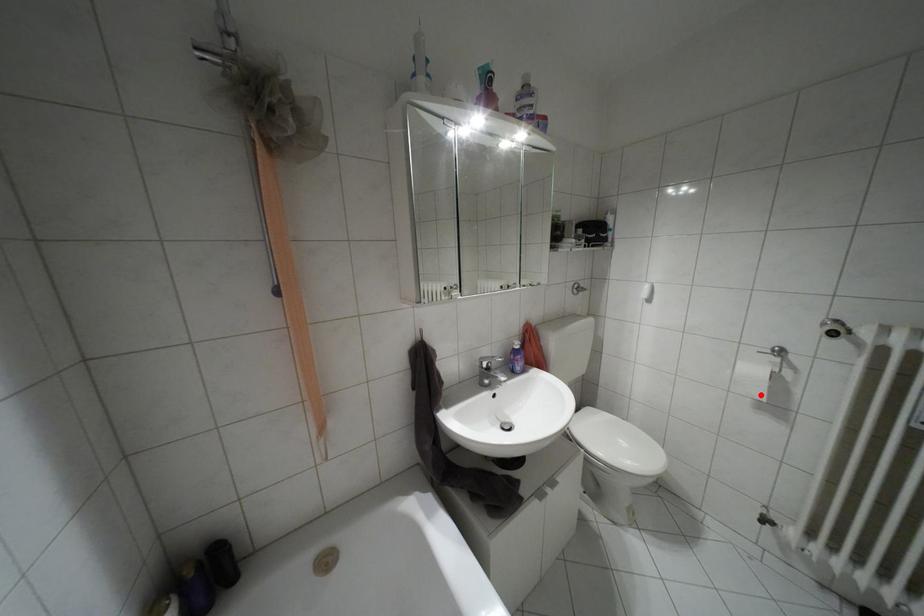
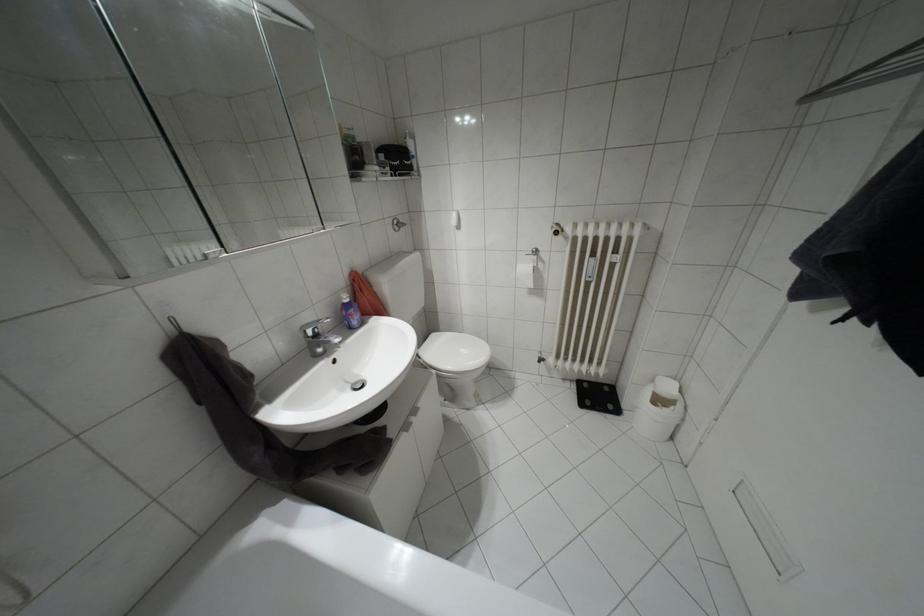
Find the pixel in the second image that matches the highlighted location in the first image.

(530, 284)